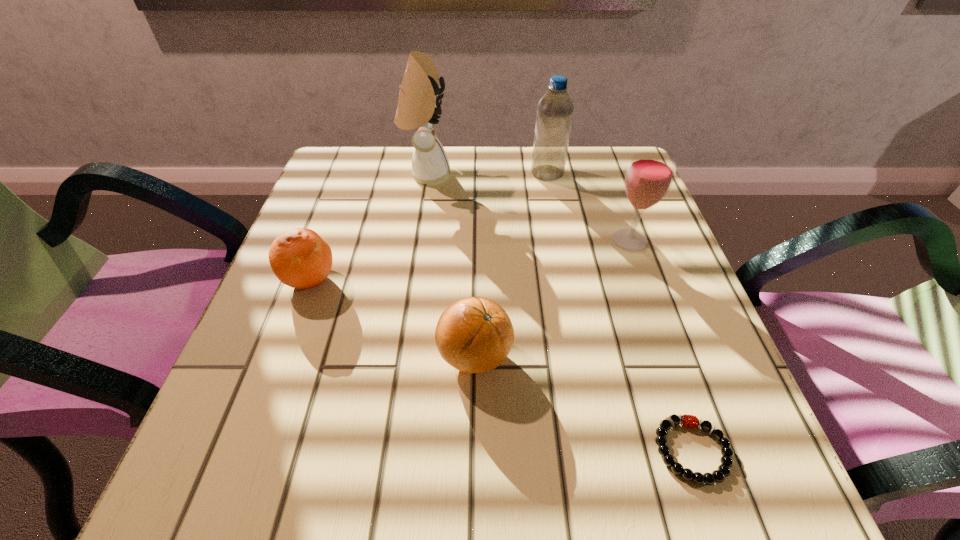
At what (x,y) coordinates should I click in order to perform the action: click on vacant space at the far right corner. Please return your answer as a coordinate pair (x, y). Looking at the image, I should click on coord(599,157).

The height and width of the screenshot is (540, 960). Identify the location of free space between the second object from left to right and the leftmost object. (369, 227).

The width and height of the screenshot is (960, 540). I want to click on vacant area that lies between the wineglass and the nearer orange, so click(552, 298).

Identify the location of free point between the third farthest object and the nearer orange. (552, 298).

Identify the location of vacant area that lies between the shortest object and the fifth shortest object. (620, 312).

You are a GUI agent. You are given a task and a screenshot of the screen. Output one action in this format:
    pyautogui.click(x=<x>, y=<y>)
    Task: Click on the free space between the third farthest object and the tallest object
    The height and width of the screenshot is (540, 960).
    Given the screenshot: What is the action you would take?
    pyautogui.click(x=528, y=207)

Identify the location of vacant area that lies between the water bottle and the third farthest object. This screenshot has height=540, width=960. (588, 206).

Where is `free space between the second tallest object and the nearest object`? free space between the second tallest object and the nearest object is located at coordinates (620, 312).

Where is `vacant space that's between the doll and the bracelet`? The image size is (960, 540). vacant space that's between the doll and the bracelet is located at coordinates (560, 312).

Identify the location of vacant space that is in between the fourth object from left to right and the nearer orange. The height and width of the screenshot is (540, 960). (511, 265).